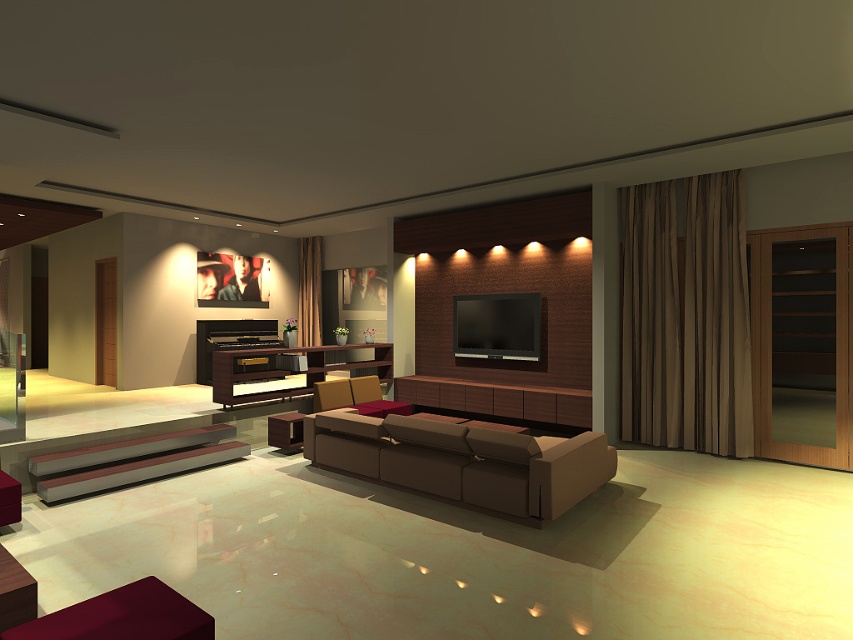
You are arranging a party in the living room and need to place a decorative pillow on the ottoman that is positioned to the left. Which ottoman should you choose between the matte burgundy ottoman at lower left and the velvet red ottoman at lower left?

You should place the decorative pillow on the velvet red ottoman at lower left because the matte burgundy ottoman at lower left is to the right of it, making the velvet red ottoman the one positioned to the left.

You are arranging a small potted plant between the metallic gray bench at lower left and the brown leather cabinet at center. Based on their positions, which object should the plant be closer to?

The metallic gray bench at lower left is positioned on the left side of the brown leather cabinet at center, so the plant should be placed closer to the metallic gray bench at lower left to maintain symmetry.